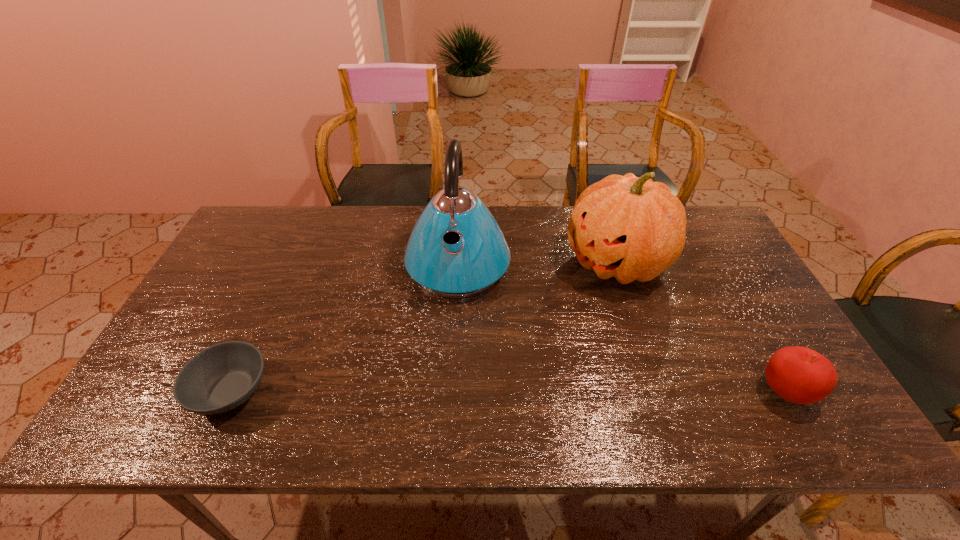
This screenshot has width=960, height=540. I want to click on blank area located at the spout of the tallest object, so click(449, 370).

At what (x,y) coordinates should I click in order to perform the action: click on free spot located at the spout of the tallest object. Please return your answer as a coordinate pair (x, y). The image size is (960, 540). Looking at the image, I should click on (447, 388).

Find the location of a particular element. This screenshot has width=960, height=540. vacant area situated at the spout of the tallest object is located at coordinates (448, 374).

The image size is (960, 540). In order to click on vacant position located on the carved face of the second tallest object in this screenshot , I will do `click(544, 312)`.

Locate an element on the screen. The image size is (960, 540). free region located on the carved face of the second tallest object is located at coordinates (506, 338).

Find the location of a particular element. This screenshot has height=540, width=960. vacant region located on the carved face of the second tallest object is located at coordinates tap(500, 342).

You are a GUI agent. You are given a task and a screenshot of the screen. Output one action in this format:
    pyautogui.click(x=<x>, y=<y>)
    Task: Click on the kettle positioned at the far edge
    
    Given the screenshot: What is the action you would take?
    pyautogui.click(x=456, y=249)

Locate an element on the screen. The height and width of the screenshot is (540, 960). pumpkin that is at the far edge is located at coordinates (631, 228).

You are a GUI agent. You are given a task and a screenshot of the screen. Output one action in this format:
    pyautogui.click(x=<x>, y=<y>)
    Task: Click on the soup bowl at the near edge
    
    Given the screenshot: What is the action you would take?
    pyautogui.click(x=222, y=377)

This screenshot has width=960, height=540. What are the coordinates of `apple positioned at the near edge` in the screenshot? It's located at (799, 375).